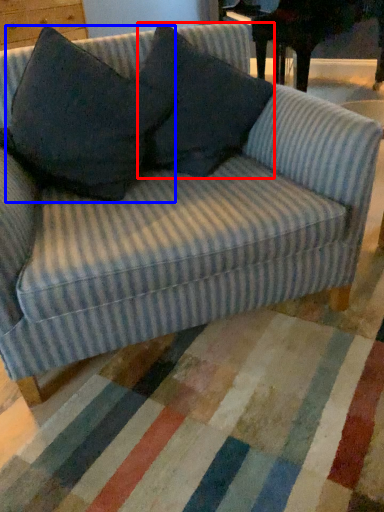
Question: Among these objects, which one is farthest to the camera, throw pillow (highlighted by a red box) or throw pillow (highlighted by a blue box)?

Choices:
 (A) throw pillow
 (B) throw pillow

Answer: (A)